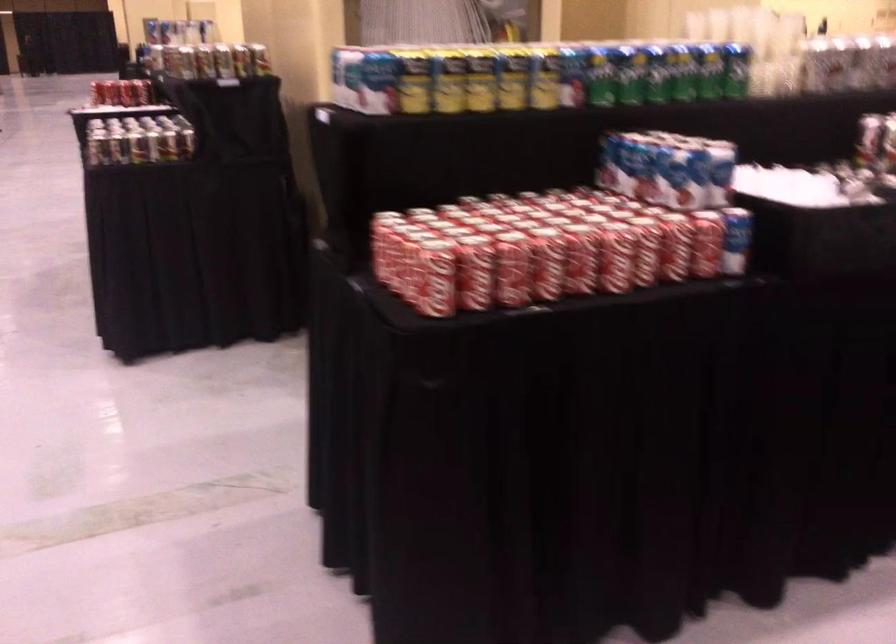
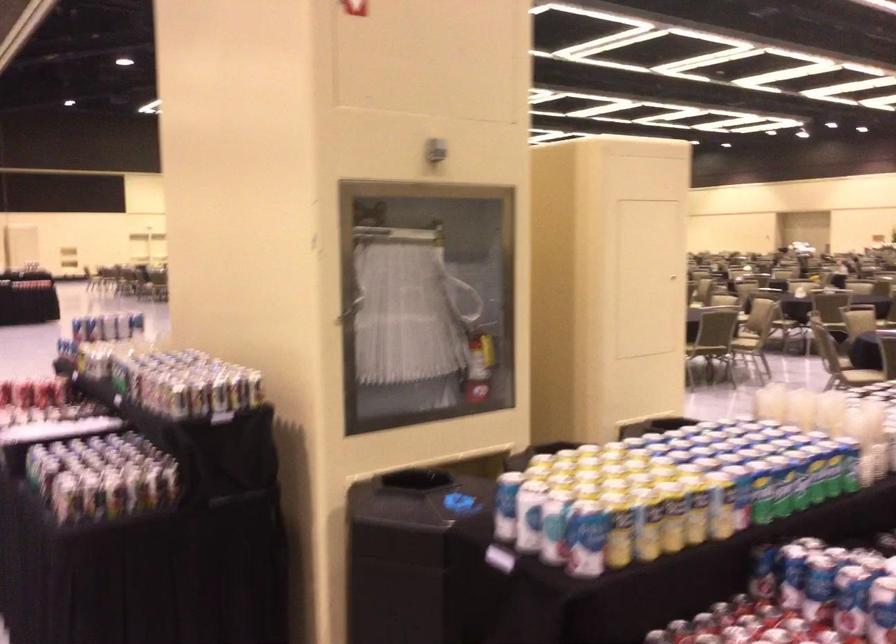
The point at (501, 75) is marked in the first image. Where is the corresponding point in the second image?

(695, 509)